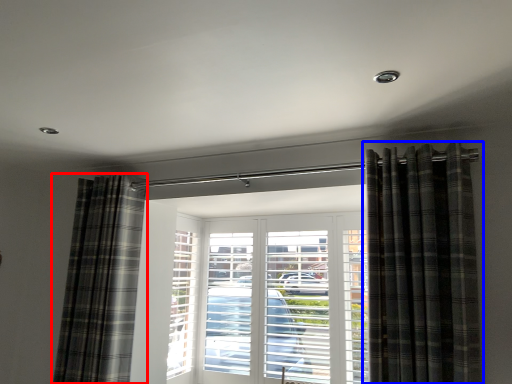
Question: Among these objects, which one is farthest to the camera, curtain (highlighted by a red box) or curtain (highlighted by a blue box)?

Choices:
 (A) curtain
 (B) curtain

Answer: (A)